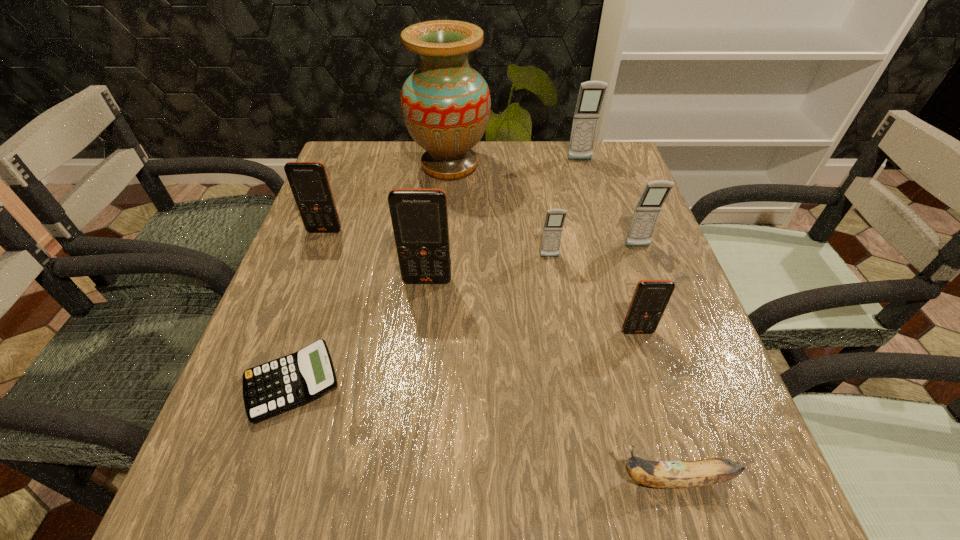
What are the coordinates of `object present at the near edge` in the screenshot? It's located at (658, 474).

You are a GUI agent. You are given a task and a screenshot of the screen. Output one action in this format:
    pyautogui.click(x=<x>, y=<y>)
    Task: Click on the cellular telephone located at the left edge
    
    Given the screenshot: What is the action you would take?
    pos(309,183)

I want to click on calculator that is at the left edge, so click(285, 383).

Locate an element on the screen. banana located at the right edge is located at coordinates (658, 474).

At what (x,y) coordinates should I click in order to perform the action: click on object located in the far right corner section of the desktop. Please return your answer as a coordinate pair (x, y). Looking at the image, I should click on (591, 94).

I want to click on object that is at the near right corner, so click(658, 474).

You are a GUI agent. You are given a task and a screenshot of the screen. Output one action in this format:
    pyautogui.click(x=<x>, y=<y>)
    Task: Click on the free region at the far edge of the desktop
    This screenshot has width=960, height=540.
    Given the screenshot: What is the action you would take?
    pyautogui.click(x=522, y=168)

Locate an element on the screen. The height and width of the screenshot is (540, 960). vacant area at the left edge of the desktop is located at coordinates (340, 303).

Locate an element on the screen. This screenshot has height=540, width=960. free region at the right edge of the desktop is located at coordinates (673, 365).

Find the location of a particular element. The width and height of the screenshot is (960, 540). vacant space at the far left corner of the desktop is located at coordinates (376, 178).